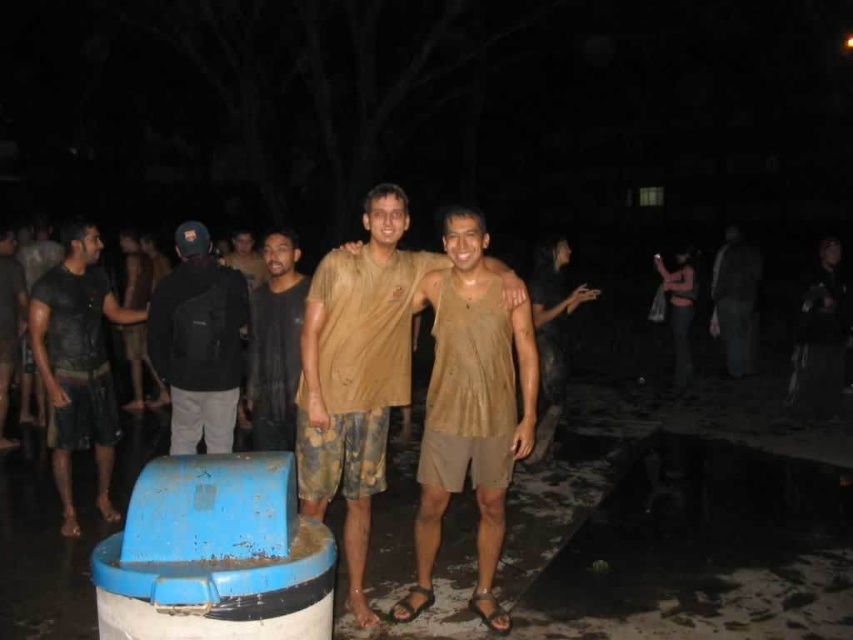
You are a photographer at a beach party. You see a dark brown fabric shirt at center and a dark gray fabric pants at right. Which clothing item is nearer to your camera?

The dark brown fabric shirt at center is closer to the viewer than dark gray fabric pants at right.